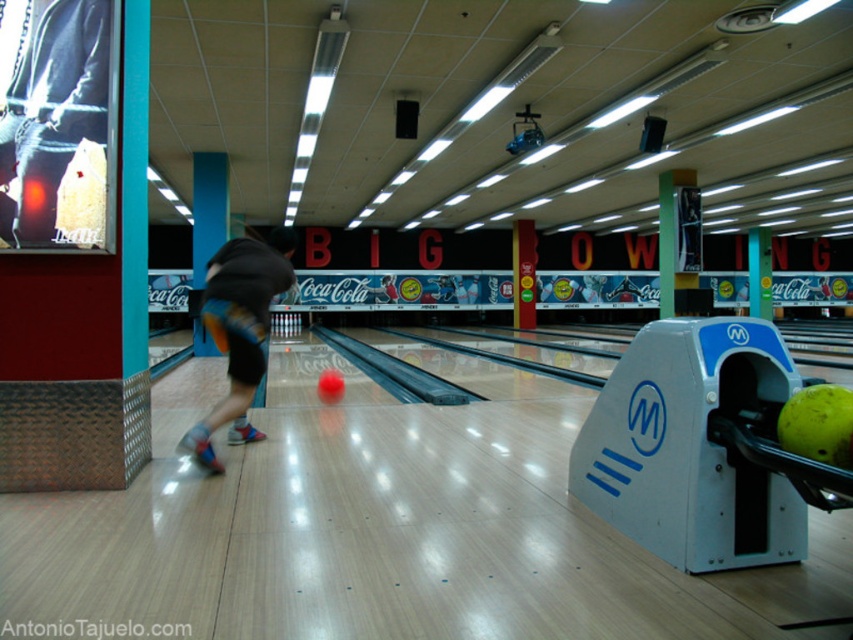
Between denim shorts at center and blue striped shorts at center, which one is positioned lower?

Positioned lower is blue striped shorts at center.

Who is shorter, denim shorts at center or blue striped shorts at center?

denim shorts at center is shorter.

The height and width of the screenshot is (640, 853). What are the coordinates of `denim shorts at center` in the screenshot? It's located at (57, 122).

At what (x,y) coordinates should I click in order to perform the action: click on denim shorts at center. Please return your answer as a coordinate pair (x, y). The image size is (853, 640). Looking at the image, I should click on (57, 122).

Can you confirm if green matte bowling ball at lower right is shorter than yellow matte bowling ball at center?

No.

Can you confirm if green matte bowling ball at lower right is positioned above yellow matte bowling ball at center?

Correct, green matte bowling ball at lower right is located above yellow matte bowling ball at center.

Locate an element on the screen. green matte bowling ball at lower right is located at coordinates (817, 424).

Between blue striped shorts at center and green matte bowling ball at lower right, which one has more height?

With more height is blue striped shorts at center.

Does blue striped shorts at center have a lesser height compared to green matte bowling ball at lower right?

No, blue striped shorts at center is not shorter than green matte bowling ball at lower right.

Identify the location of blue striped shorts at center. This screenshot has width=853, height=640. (241, 330).

This screenshot has height=640, width=853. Identify the location of blue striped shorts at center. (241, 330).